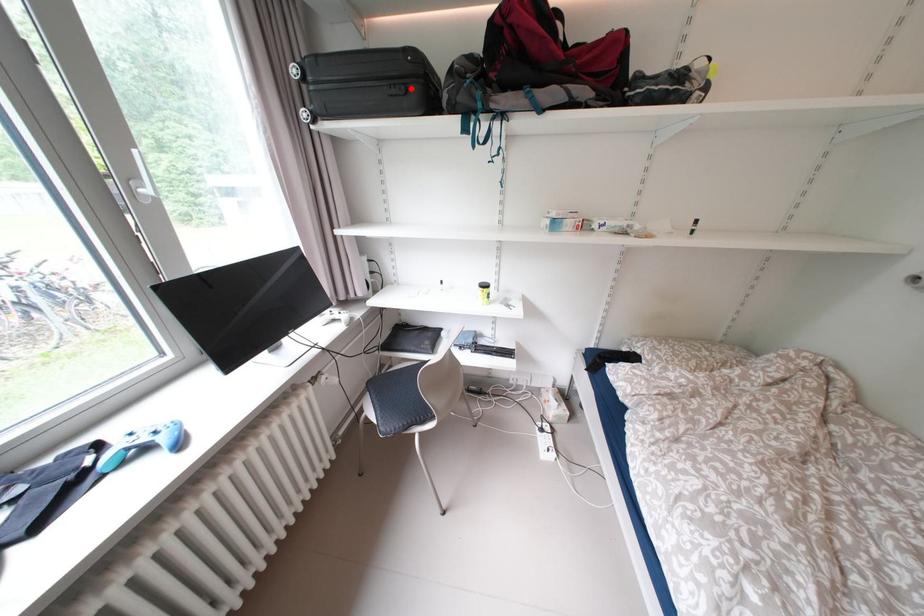
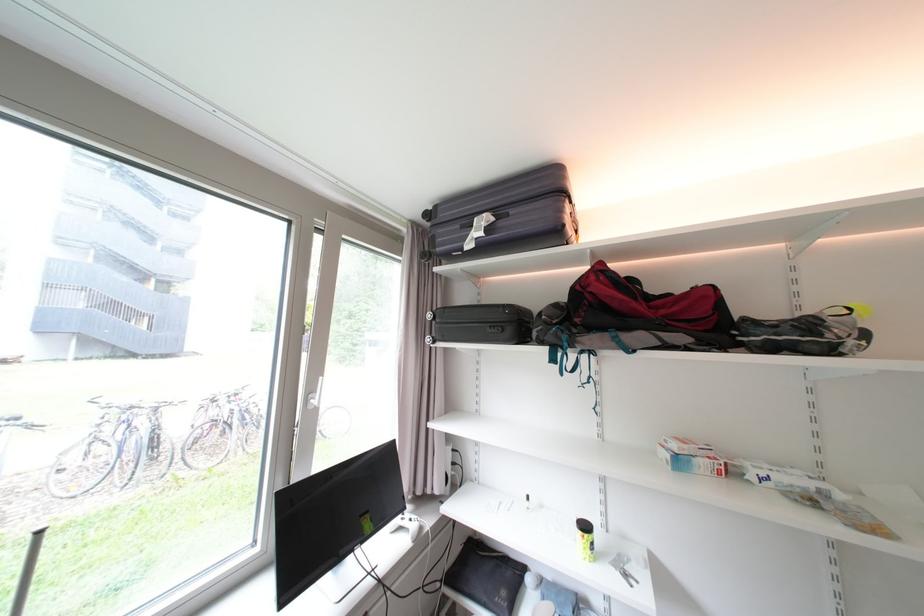
The point at the highlighted location is marked in the first image. Where is the corresponding point in the second image?

(507, 330)